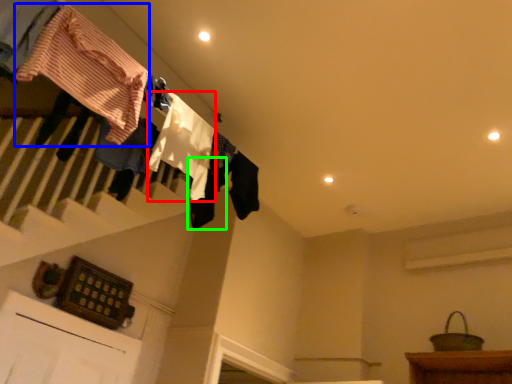
Question: Based on their relative distances, which object is farther from clothing (highlighted by a red box)? Choose from clothing (highlighted by a blue box) and clothing (highlighted by a green box).

Choices:
 (A) clothing
 (B) clothing

Answer: (A)